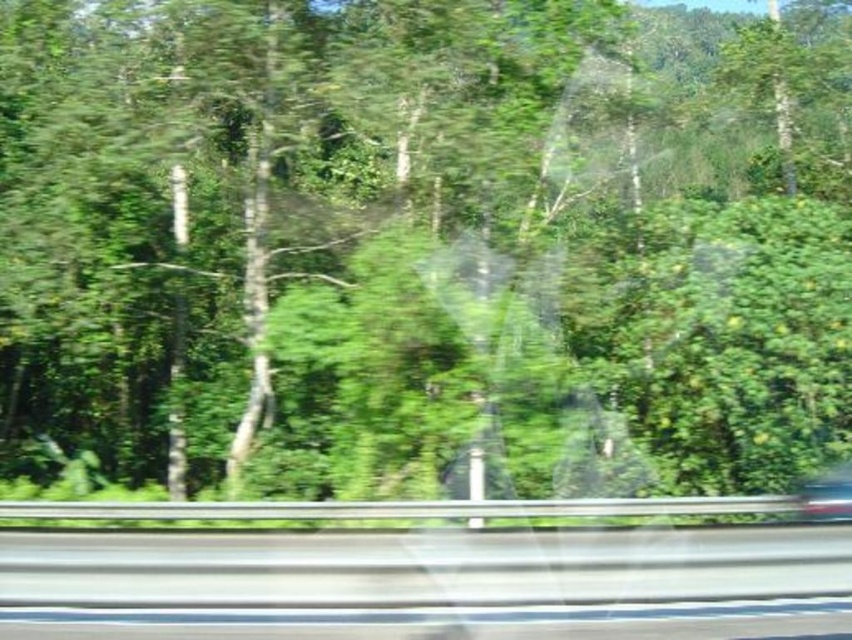
You are driving a car and want to know how far the smooth asphalt highway at center is from your eyes. Can you determine the distance using the information provided?

The smooth asphalt highway at center is 23.22 feet away from the camera, so the distance from your eyes to the smooth asphalt highway at center would be approximately 23.22 feet.

You are a passenger in a car and see the smooth asphalt highway at center and the metallic silver car at lower right through the window. Which object is closer to you?

The metallic silver car at lower right is closer to you because the smooth asphalt highway at center is positioned over it, indicating it is further away.